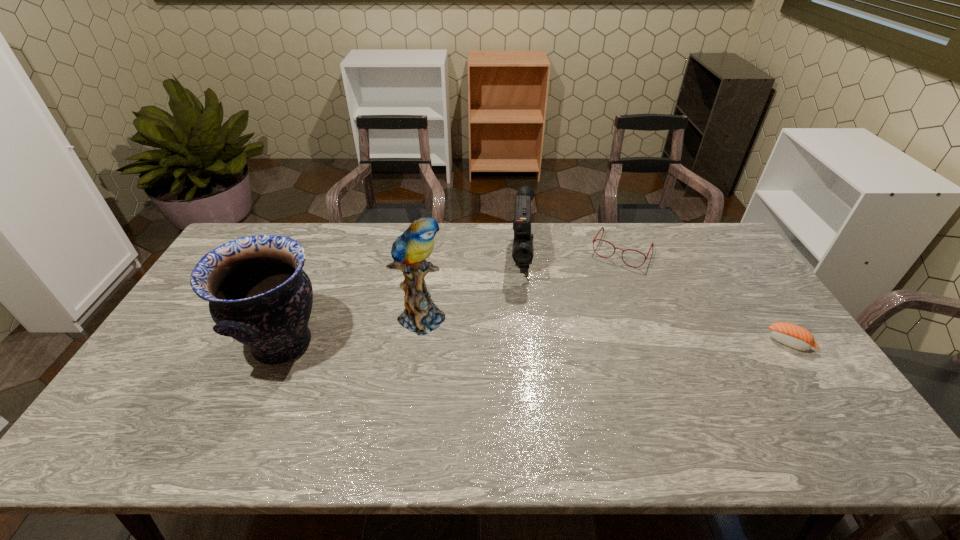
At what (x,y) coordinates should I click in order to perform the action: click on vacant space located on the front-facing side of the camcorder. Please return your answer as a coordinate pair (x, y). Image resolution: width=960 pixels, height=540 pixels. Looking at the image, I should click on (525, 341).

Where is `free region located on the front-facing side of the camcorder`? Image resolution: width=960 pixels, height=540 pixels. free region located on the front-facing side of the camcorder is located at coordinates (525, 322).

You are a GUI agent. You are given a task and a screenshot of the screen. Output one action in this format:
    pyautogui.click(x=<x>, y=<y>)
    Task: Click on the free space located 0.400m on the front-facing side of the camcorder
    This screenshot has height=540, width=960.
    Given the screenshot: What is the action you would take?
    pyautogui.click(x=527, y=396)

Where is `spectacles that is at the far edge`? The height and width of the screenshot is (540, 960). spectacles that is at the far edge is located at coordinates (594, 239).

The height and width of the screenshot is (540, 960). Identify the location of camcorder that is at the far edge. (522, 251).

You are a GUI agent. You are given a task and a screenshot of the screen. Output one action in this format:
    pyautogui.click(x=<x>, y=<y>)
    Task: Click on the object that is positioned at the near edge
    Image resolution: width=960 pixels, height=540 pixels.
    Given the screenshot: What is the action you would take?
    pyautogui.click(x=258, y=293)

Where is `object at the right edge`? The height and width of the screenshot is (540, 960). object at the right edge is located at coordinates (x=794, y=336).

This screenshot has width=960, height=540. In the image, there is a desktop. Identify the location of free space at the far edge. (552, 236).

The image size is (960, 540). What are the coordinates of `free space at the near edge of the desktop` in the screenshot? It's located at (555, 388).

Find the location of `free spot at the left edge of the desktop`. free spot at the left edge of the desktop is located at coordinates (208, 369).